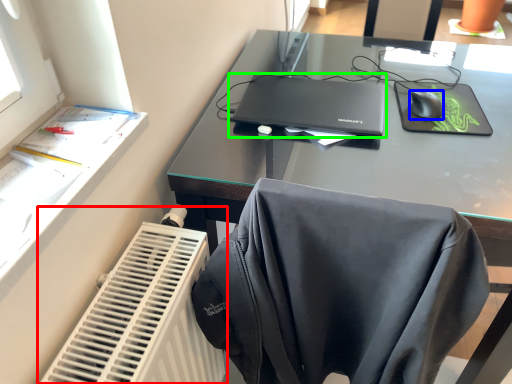
Question: Considering the real-world distances, which object is closest to radiator (highlighted by a red box)? mouse (highlighted by a blue box) or laptop (highlighted by a green box).

Choices:
 (A) mouse
 (B) laptop

Answer: (B)